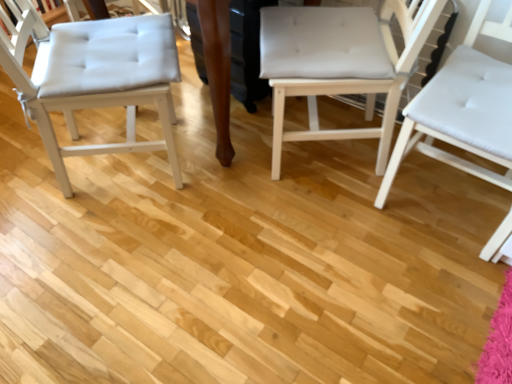
Question: Considering their positions, is white leather chair at right, placed as the 3th chair when sorted from left to right, located in front of or behind white tufted cushion at left, arranged as the third chair when viewed from the right?

Choices:
 (A) front
 (B) behind

Answer: (A)

Question: Would you say white leather chair at right, acting as the first chair starting from the right, is inside or outside white tufted cushion at left, arranged as the third chair when viewed from the right?

Choices:
 (A) outside
 (B) inside

Answer: (A)

Question: Which is farther from the white leather chair at right, acting as the first chair starting from the right?

Choices:
 (A) white fabric chair at center, which appears as the second chair when viewed from the right
 (B) white tufted cushion at left, which is the 1th chair in left-to-right order

Answer: (B)

Question: Based on their relative distances, which object is farther from the white fabric chair at center, which appears as the second chair when viewed from the right?

Choices:
 (A) white tufted cushion at left, arranged as the third chair when viewed from the right
 (B) white leather chair at right, acting as the first chair starting from the right

Answer: (A)